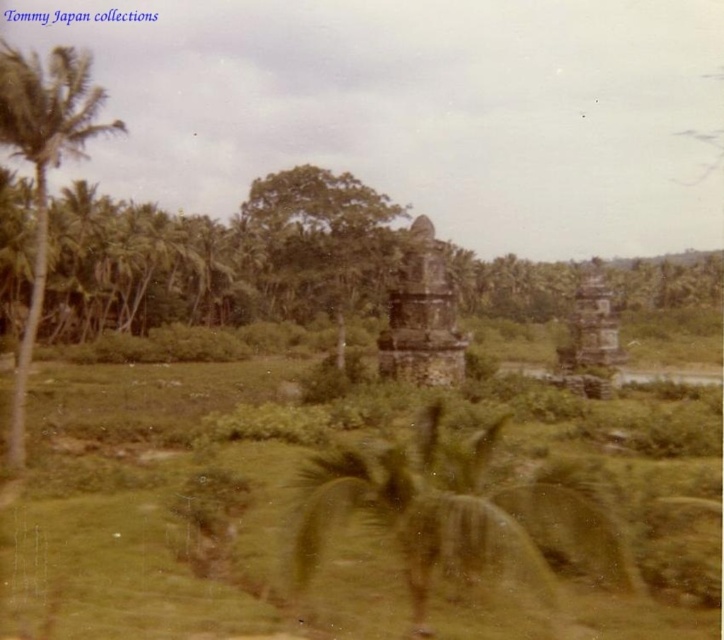
In the scene shown: You are a photographer planning to capture the dark brown stone temple at center and the green leafy palm tree at left in a single frame. Based on their sizes, which object should you focus on to ensure the temple is clearly visible without the palm tree overwhelming the composition?

The green leafy palm tree at left is larger in size than the dark brown stone temple at center. To ensure the temple remains clearly visible, focus on the temple while considering the palm tree placement to avoid it overshadowing the composition.

In the scene shown: You are a photographer standing in the grassy field. You want to take a picture of the dark brown stone temple at center and the green leafy palm tree at center. Based on their positions, which object should you frame first in your camera viewfinder to ensure both are in the shot?

Since the green leafy palm tree at center is to the left of the dark brown stone temple at center, you should frame the dark brown stone temple at center first as it is positioned to the right, allowing space for the palm tree to be included on its left side in the viewfinder.